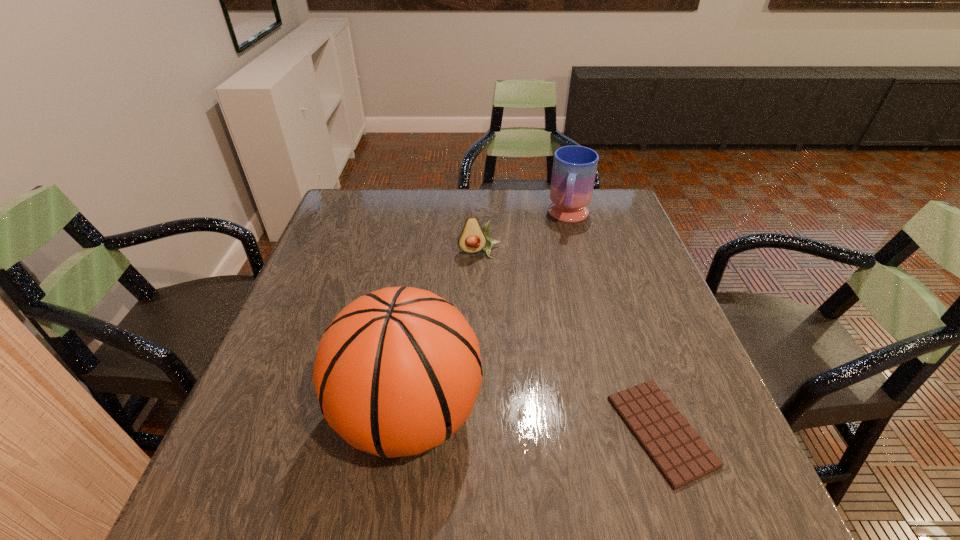
What are the coordinates of `free region located on the seed side of the third tallest object` in the screenshot? It's located at (499, 345).

Identify the location of vacant area situated 0.180m on the side of the farthest object with the handle. (561, 273).

At what (x,y) coordinates should I click in order to perform the action: click on free region located 0.150m on the side of the farthest object with the handle. Please return your answer as a coordinate pair (x, y). The width and height of the screenshot is (960, 540). Looking at the image, I should click on (562, 266).

I want to click on vacant region located 0.350m on the side of the farthest object with the handle, so click(551, 319).

This screenshot has height=540, width=960. Identify the location of object located at the far edge. (574, 170).

Identify the location of basketball that is at the near edge. This screenshot has height=540, width=960. (397, 372).

You are a GUI agent. You are given a task and a screenshot of the screen. Output one action in this format:
    pyautogui.click(x=<x>, y=<y>)
    Task: Click on the chocolate bar positioned at the near edge
    The image size is (960, 540).
    Given the screenshot: What is the action you would take?
    pyautogui.click(x=680, y=454)

Identify the location of chocolate bar located in the right edge section of the desktop. (680, 454).

Image resolution: width=960 pixels, height=540 pixels. What are the coordinates of `mug positioned at the right edge` in the screenshot? It's located at (574, 170).

You are a GUI agent. You are given a task and a screenshot of the screen. Output one action in this format:
    pyautogui.click(x=<x>, y=<y>)
    Task: Click on the object situated at the far right corner
    The image size is (960, 540).
    Given the screenshot: What is the action you would take?
    pyautogui.click(x=574, y=170)